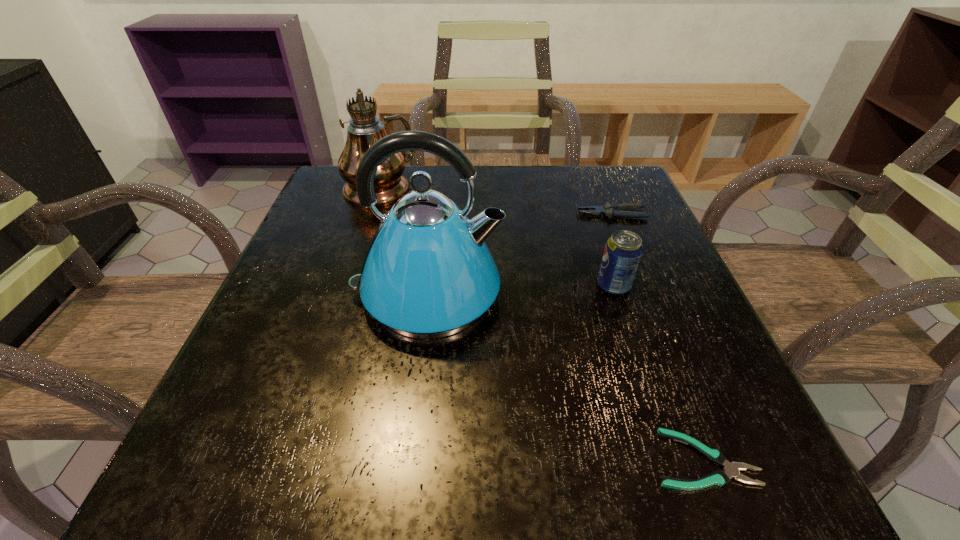
Locate which object is the closest to the second tallest object. Please provide its 2D coordinates. Your answer should be formatted as a tuple, i.e. [(x, y)], where the tuple contains the x and y coordinates of a point satisfying the conditions above.

[(356, 81)]

In order to click on blank area in the image that satisfies the following two spatial constraints: 1. at the spout of the fourth shortest object; 2. on the left side of the nearer pliers in this screenshot , I will do `click(406, 459)`.

You are a GUI agent. You are given a task and a screenshot of the screen. Output one action in this format:
    pyautogui.click(x=<x>, y=<y>)
    Task: Click on the vacant space that satisfies the following two spatial constraints: 1. on the front side of the oil lamp; 2. on the right side of the third shortest object
    Image resolution: width=960 pixels, height=540 pixels.
    Given the screenshot: What is the action you would take?
    pyautogui.click(x=348, y=286)